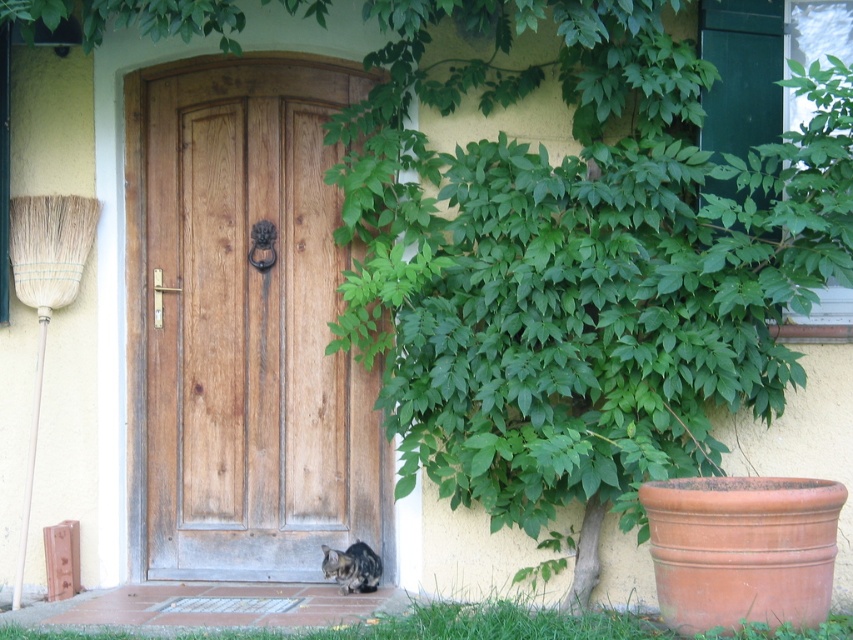
Question: Is the position of natural wood door at center more distant than that of tabby fur cat at lower center?

Choices:
 (A) no
 (B) yes

Answer: (B)

Question: Which point is closer to the camera?

Choices:
 (A) (494, 609)
 (B) (334, 573)

Answer: (A)

Question: Which of the following is the farthest from the observer?

Choices:
 (A) green leafy plant at lower right
 (B) natural wood door at center
 (C) tabby fur cat at lower center

Answer: (B)

Question: Does natural wood door at center appear under green leafy plant at lower right?

Choices:
 (A) yes
 (B) no

Answer: (B)

Question: Which of the following is the closest to the observer?

Choices:
 (A) natural wood door at center
 (B) green leafy plant at lower right

Answer: (B)

Question: Is natural wood door at center in front of tabby fur cat at lower center?

Choices:
 (A) yes
 (B) no

Answer: (B)